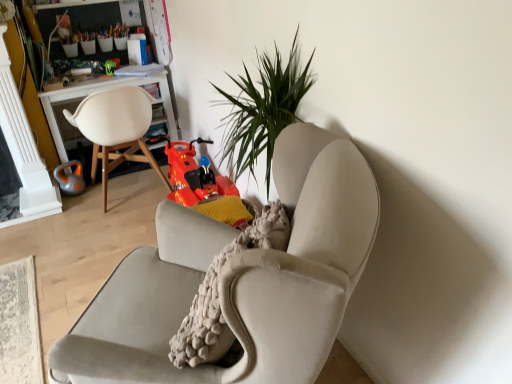
You are a GUI agent. You are given a task and a screenshot of the screen. Output one action in this format:
    pyautogui.click(x=<x>, y=<y>)
    Task: Click on the vacant space situated above velvet beige armchair at center, the 1th chair viewed from the right (from a real-world perspective)
    This screenshot has height=384, width=512.
    Given the screenshot: What is the action you would take?
    pyautogui.click(x=93, y=241)